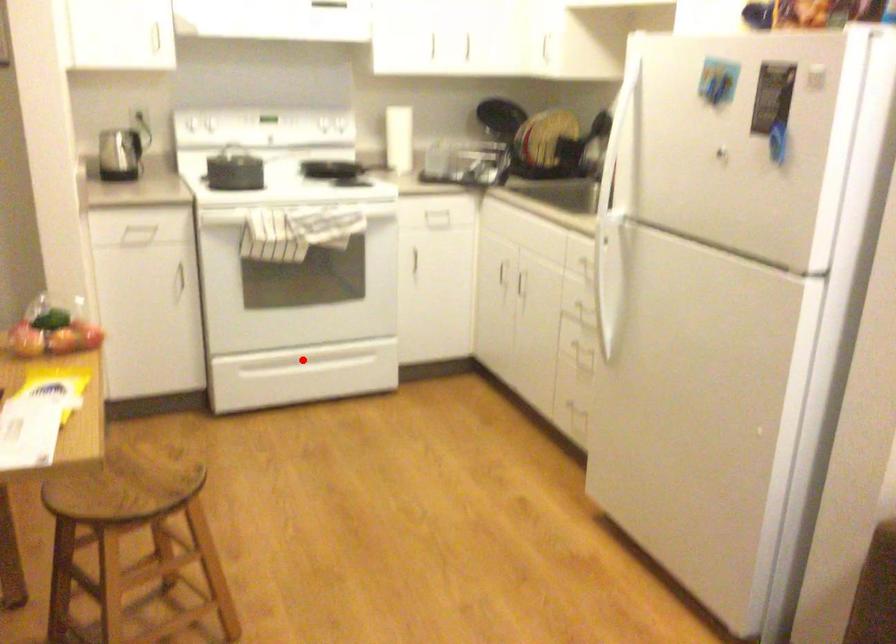
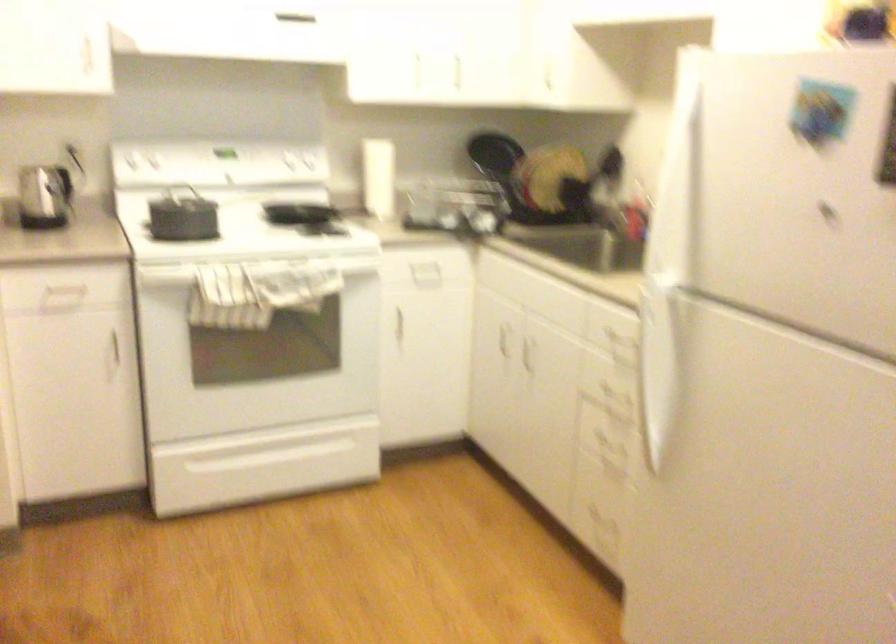
Question: A red point is marked in image1. In image2, is the corresponding 3D point closer to the camera or farther? Reply with the corresponding letter.

Choices:
 (A) The corresponding 3D point is closer.
 (B) The corresponding 3D point is farther.

Answer: (A)